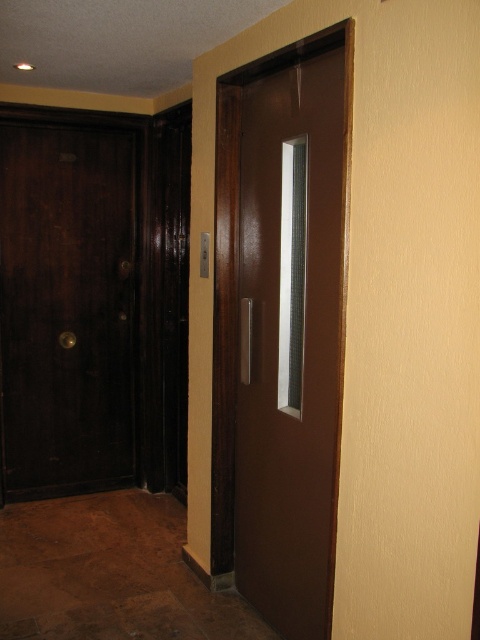
You are standing in the hallway and need to locate the glossy brown door at center. Which direction should you move relative to the dark wood door at left?

The glossy brown door at center is to the right of the dark wood door at left, so you should move to the right of the dark wood door at left to find it.

You are standing in the hallway and need to find the glossy brown door at center. According to the coordinates provided, where should you look to locate it?

The glossy brown door at center is located at the coordinates point (x=288, y=342).